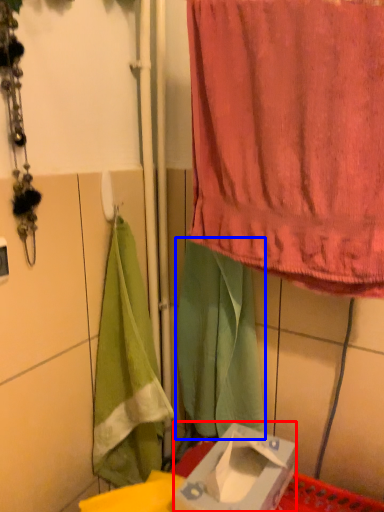
Question: Which of the following is the farthest to the observer, box (highlighted by a red box) or cloth (highlighted by a blue box)?

Choices:
 (A) box
 (B) cloth

Answer: (B)